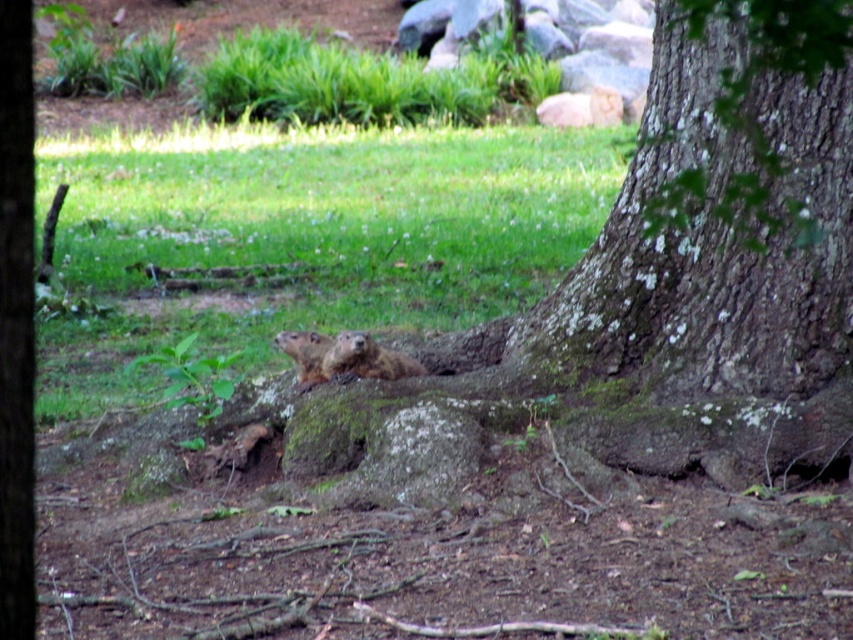
You are a nature photographer aiming to capture both the brown rough bark at center and the brown furry ground squirrel at center in a single frame. Which object will appear narrower in your photo?

The brown rough bark at center will appear narrower in the photo because it is thinner than the brown furry ground squirrel at center.

You are a nature photographer aiming to capture both the brown furry ground squirrel at center and the brown furry groundhog at center in a single frame. Based on their positions, which one is positioned lower in the image?

The brown furry ground squirrel at center is located below the brown furry groundhog at center, so it is positioned lower in the image.